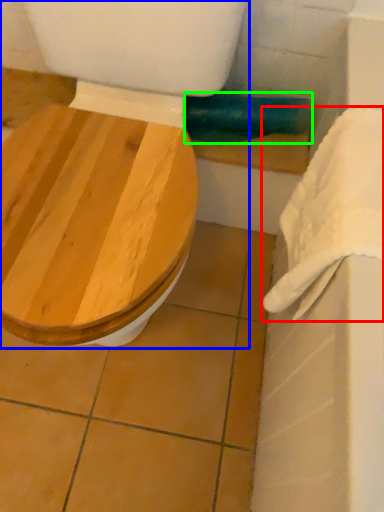
Question: Which object is the closest to the towel/napkin (highlighted by a red box)? Choose among these: toilet (highlighted by a blue box) or towel bar (highlighted by a green box).

Choices:
 (A) toilet
 (B) towel bar

Answer: (A)